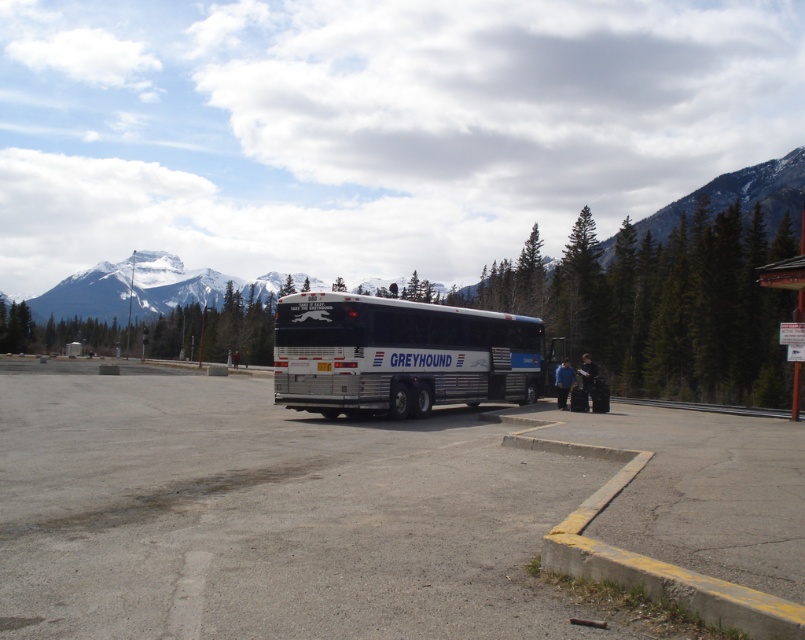
Between metallic sign at right and blue fabric jacket at lower center, which one appears on the left side from the viewer's perspective?

blue fabric jacket at lower center is more to the left.

Is metallic sign at right wider than blue fabric jacket at lower center?

Correct, the width of metallic sign at right exceeds that of blue fabric jacket at lower center.

Is point (795, 362) farther from viewer compared to point (566, 372)?

That is False.

Where is `metallic sign at right`? The height and width of the screenshot is (640, 805). metallic sign at right is located at coordinates (786, 276).

Who is more distant from viewer, (290, 342) or (556, 368)?

The point (556, 368) is more distant.

Can you confirm if white metallic bus at center is bigger than blue fabric jacket at lower center?

Indeed, white metallic bus at center has a larger size compared to blue fabric jacket at lower center.

Locate an element on the screen. Image resolution: width=805 pixels, height=640 pixels. white metallic bus at center is located at coordinates (399, 355).

Does white metallic bus at center have a greater height compared to metallic sign at right?

Incorrect, white metallic bus at center's height is not larger of metallic sign at right's.

At what (x,y) coordinates should I click in order to perform the action: click on white metallic bus at center. Please return your answer as a coordinate pair (x, y). Looking at the image, I should click on (399, 355).

Between point (386, 378) and point (787, 273), which one is positioned behind?

The point (787, 273) is more distant.

The image size is (805, 640). What are the coordinates of `white metallic bus at center` in the screenshot? It's located at (399, 355).